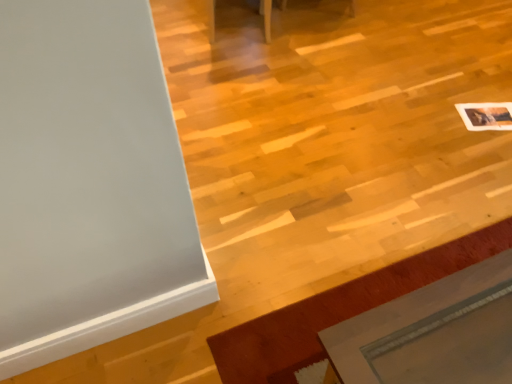
What do you see at coordinates (339, 310) in the screenshot?
I see `wooden textured mat at lower right` at bounding box center [339, 310].

What is the approximate width of wooden textured mat at lower right?

wooden textured mat at lower right is 29.94 centimeters wide.

At what (x,y) coordinates should I click in order to perform the action: click on wooden textured mat at lower right. Please return your answer as a coordinate pair (x, y). The image size is (512, 384). Looking at the image, I should click on (339, 310).

Locate an element on the screen. This screenshot has height=384, width=512. wooden textured mat at lower right is located at coordinates (339, 310).